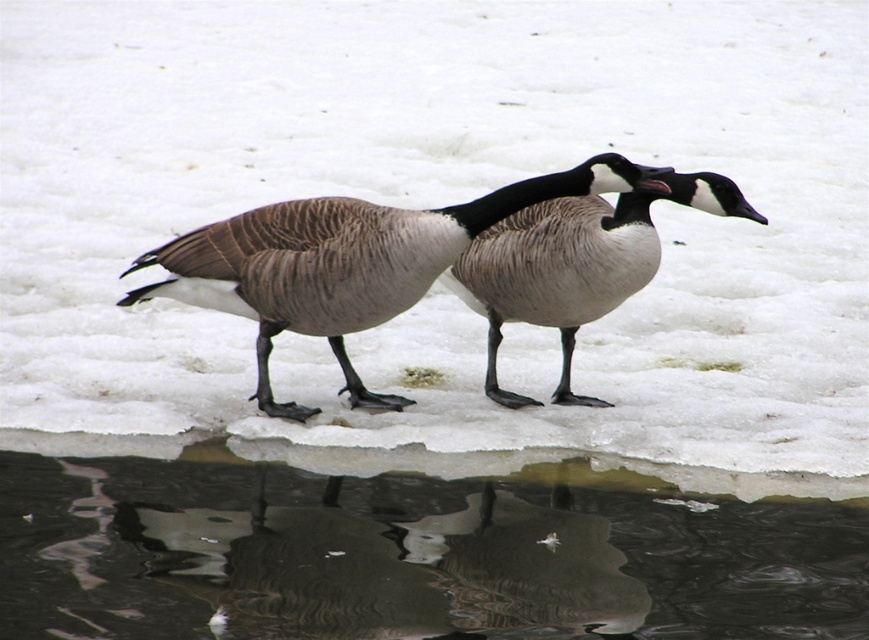
You are a wildlife photographer trying to capture a clear photo of the brown feathered goose at center and the brown speckled goose at center. Which goose would appear closer to the camera in the photo?

The brown feathered goose at center would appear closer to the camera in the photo because it is positioned in front of the brown speckled goose at center.

You observe two geese on a frozen pond. There is a brown feathered goose at center and a brown speckled goose at center. Which goose is located to the left when viewed from the observer perspective?

The brown feathered goose at center is positioned on the left side of the brown speckled goose at center, so it is the one located to the left.

You are a photographer trying to capture the brown feathered goose at center. You notice the transparent ice at lower center might interfere with your shot. Is the ice between you and the goose, or behind it?

The transparent ice at lower center is in front of the brown feathered goose at center, meaning it is between you and the goose.